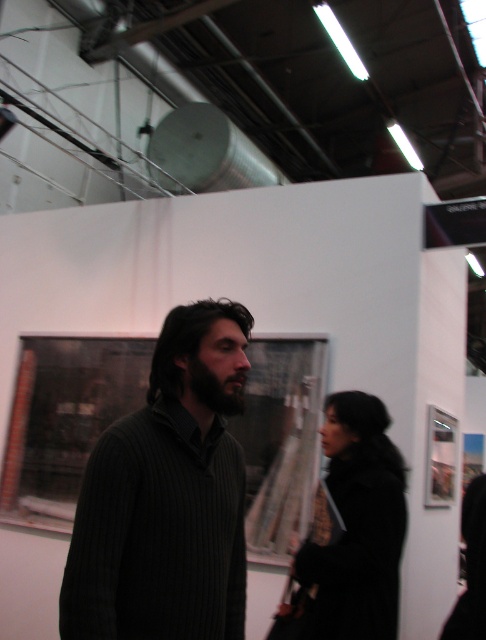
Question: Is dark ribbed sweater at center further to camera compared to black wool coat at center?

Choices:
 (A) yes
 (B) no

Answer: (B)

Question: Which point is closer to the camera?

Choices:
 (A) black wool coat at center
 (B) dark ribbed sweater at center

Answer: (B)

Question: Can you confirm if dark ribbed sweater at center is wider than black wool coat at center?

Choices:
 (A) yes
 (B) no

Answer: (B)

Question: Does dark ribbed sweater at center lie in front of black wool coat at center?

Choices:
 (A) no
 (B) yes

Answer: (B)

Question: Which of the following is the farthest from the observer?

Choices:
 (A) (299, 612)
 (B) (81, 496)

Answer: (A)